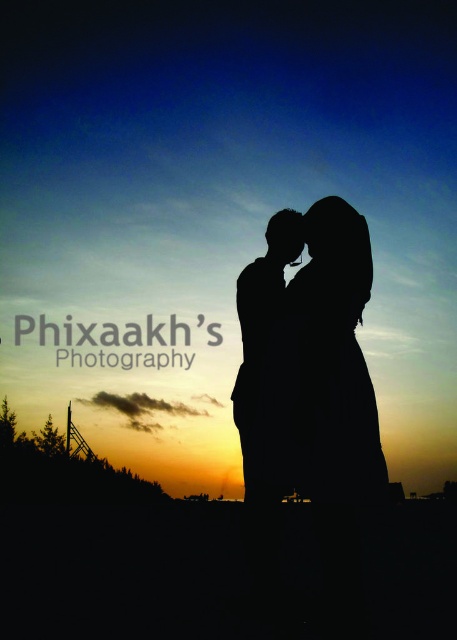
Question: Is silhouette couple at center below black matte silhouette at center?

Choices:
 (A) yes
 (B) no

Answer: (A)

Question: Which of the following is the closest to the observer?

Choices:
 (A) (327, 348)
 (B) (291, 253)

Answer: (A)

Question: Which point appears farthest from the camera in this image?

Choices:
 (A) (259, 380)
 (B) (309, 369)

Answer: (A)

Question: Is silhouette couple at center smaller than black matte silhouette at center?

Choices:
 (A) yes
 (B) no

Answer: (A)

Question: Does silhouette couple at center appear on the right side of black matte silhouette at center?

Choices:
 (A) yes
 (B) no

Answer: (A)